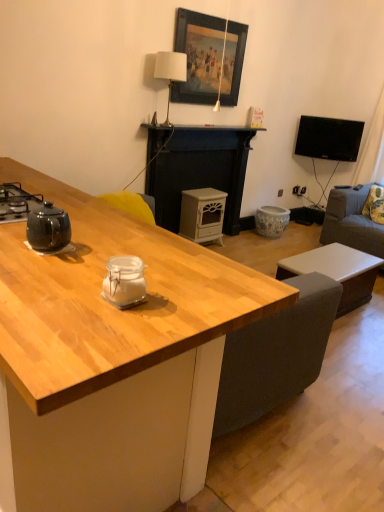
In order to click on vacant area in front of clear glass jar at center, the 2th appliance when ordered from right to left in this screenshot , I will do `click(111, 331)`.